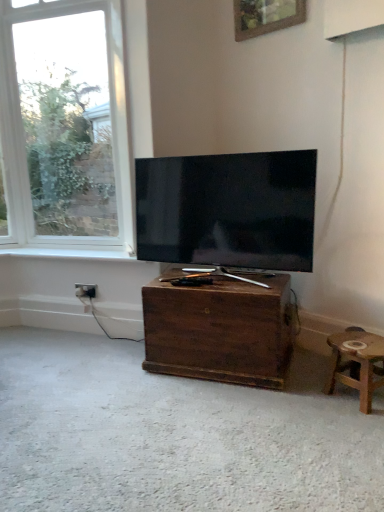
Question: Considering the relative positions of dark wood chest at center and white wood window sill at lower left in the image provided, is dark wood chest at center in front of white wood window sill at lower left?

Choices:
 (A) yes
 (B) no

Answer: (A)

Question: Is white wood window sill at lower left inside dark wood chest at center?

Choices:
 (A) no
 (B) yes

Answer: (A)

Question: Does dark wood chest at center have a lesser height compared to white wood window sill at lower left?

Choices:
 (A) yes
 (B) no

Answer: (B)

Question: From the image's perspective, does dark wood chest at center appear higher than white wood window sill at lower left?

Choices:
 (A) yes
 (B) no

Answer: (B)

Question: Considering the relative positions of dark wood chest at center and white wood window sill at lower left in the image provided, is dark wood chest at center to the left of white wood window sill at lower left from the viewer's perspective?

Choices:
 (A) no
 (B) yes

Answer: (A)

Question: Considering the positions of point (119, 249) and point (360, 362), is point (119, 249) closer or farther from the camera than point (360, 362)?

Choices:
 (A) closer
 (B) farther

Answer: (B)

Question: Considering the positions of white wood window sill at lower left and wooden stool at lower right in the image, is white wood window sill at lower left wider or thinner than wooden stool at lower right?

Choices:
 (A) wide
 (B) thin

Answer: (B)

Question: From their relative heights in the image, would you say white wood window sill at lower left is taller or shorter than wooden stool at lower right?

Choices:
 (A) short
 (B) tall

Answer: (A)

Question: In terms of size, does white wood window sill at lower left appear bigger or smaller than wooden stool at lower right?

Choices:
 (A) small
 (B) big

Answer: (A)

Question: Is point (91, 287) closer or farther from the camera than point (183, 159)?

Choices:
 (A) farther
 (B) closer

Answer: (A)

Question: From the image's perspective, is black plastic power outlet at lower left positioned above or below matte black tv at center?

Choices:
 (A) below
 (B) above

Answer: (A)

Question: Is black plastic power outlet at lower left bigger or smaller than matte black tv at center?

Choices:
 (A) big
 (B) small

Answer: (B)

Question: From a real-world perspective, is black plastic power outlet at lower left positioned above or below matte black tv at center?

Choices:
 (A) above
 (B) below

Answer: (B)

Question: Visually, is clear glass window at upper left positioned to the left or to the right of matte black tv at center?

Choices:
 (A) right
 (B) left

Answer: (B)

Question: Is point (66, 114) closer or farther from the camera than point (304, 229)?

Choices:
 (A) closer
 (B) farther

Answer: (B)